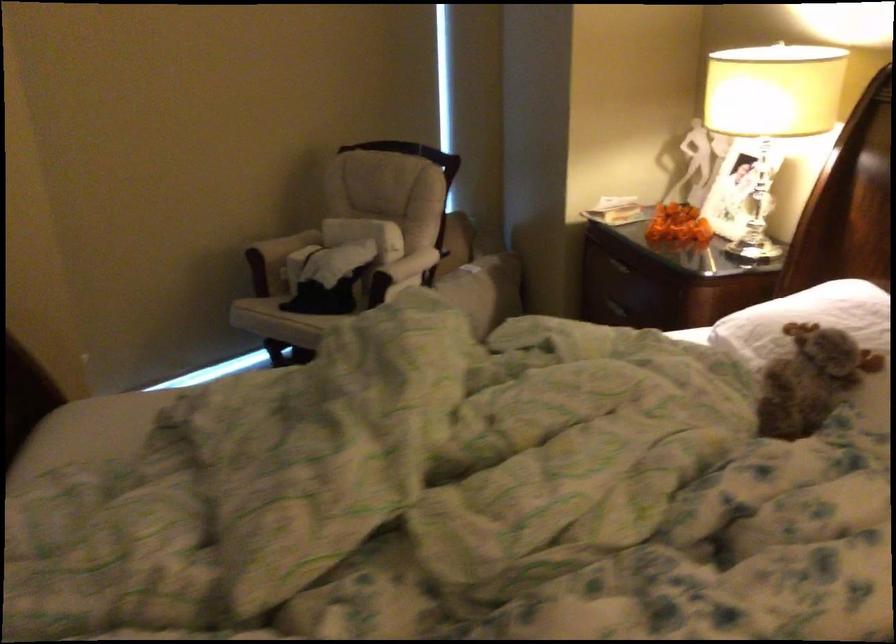
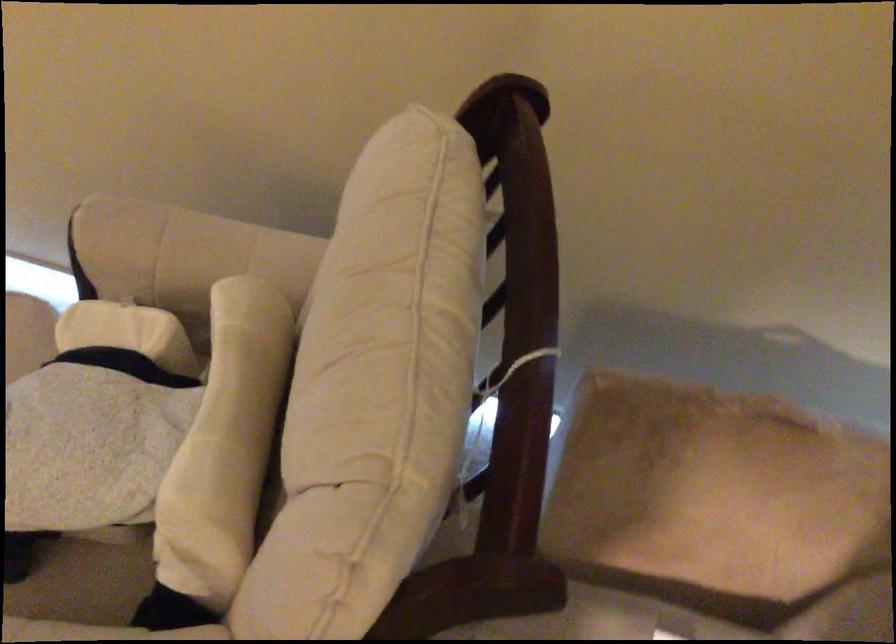
In the second image, find the point that corresponds to pixel 460 272 in the first image.

(604, 621)